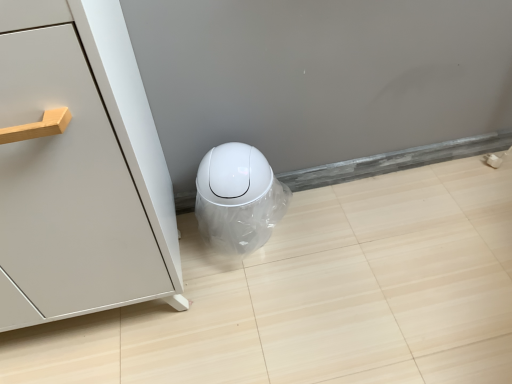
What are the coordinates of `vacant area that lies to the right of white glossy trash can at lower center` in the screenshot? It's located at (311, 231).